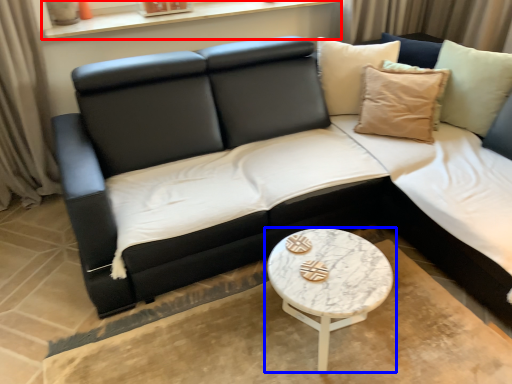
Question: Among these objects, which one is farthest to the camera, window sill (highlighted by a red box) or coffee table (highlighted by a blue box)?

Choices:
 (A) window sill
 (B) coffee table

Answer: (A)